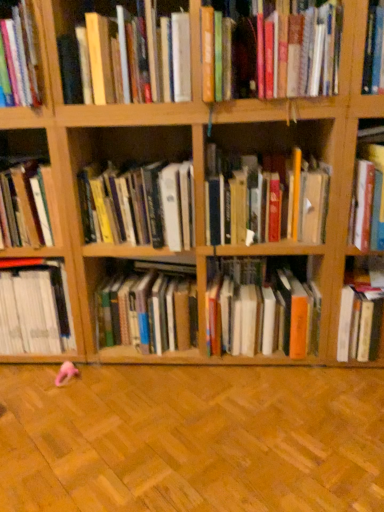
I want to click on hardcover book at upper center, the fifth book in the right-to-left sequence, so pyautogui.click(x=297, y=53).

Find the location of a particular element. hardcover book at center, which is the eighth book in left-to-right order is located at coordinates (265, 200).

The width and height of the screenshot is (384, 512). I want to click on hardcover book at right, placed as the 1th book when sorted from right to left, so click(362, 314).

Locate an element on the screen. This screenshot has width=384, height=512. hardcover book at center, placed as the sixth book when sorted from right to left is located at coordinates (148, 309).

Is point (246, 335) positioned behind point (352, 320)?

Yes, point (246, 335) is farther from viewer.

Considering the relative positions of orange matte book at center, arranged as the third book when viewed from the right, and hardcover book at right, placed as the 1th book when sorted from right to left, in the image provided, is orange matte book at center, arranged as the third book when viewed from the right, to the right of hardcover book at right, placed as the 1th book when sorted from right to left, from the viewer's perspective?

No.

From a real-world perspective, relative to hardcover book at right, which is the eleventh book from left to right, is orange matte book at center, arranged as the 9th book when viewed from the left, vertically above or below?

orange matte book at center, arranged as the 9th book when viewed from the left, is situated higher than hardcover book at right, which is the eleventh book from left to right, in the real world.

Is orange matte book at center, arranged as the third book when viewed from the right, in front of hardcover book at right, placed as the 1th book when sorted from right to left?

Yes, orange matte book at center, arranged as the third book when viewed from the right, is closer to the camera.

Identify the location of book that is the 1st object directly below the hardcover book at center, which is the eighth book in left-to-right order (from a real-world perspective). This screenshot has width=384, height=512. (24, 205).

In the scene shown: Can hardcover book at left, which is counted as the 11th book, starting from the right, be found inside hardcover book at center, which is the eighth book in left-to-right order?

No, hardcover book at center, which is the eighth book in left-to-right order, does not contain hardcover book at left, which is counted as the 11th book, starting from the right.

Which of these two, hardcover book at center, which appears as the 4th book when viewed from the right, or hardcover book at left, which is counted as the 11th book, starting from the right, is smaller?

hardcover book at left, which is counted as the 11th book, starting from the right, is smaller.

Choose the correct answer: Is hardcover book at upper right, the tenth book when ordered from left to right, inside hardcover book at upper left, which ranks as the third book in left-to-right order, or outside it?

hardcover book at upper right, the tenth book when ordered from left to right, is located beyond the bounds of hardcover book at upper left, which ranks as the third book in left-to-right order.

Considering the positions of points (350, 216) and (23, 45), is point (350, 216) farther from camera compared to point (23, 45)?

Yes, point (350, 216) is behind point (23, 45).

Considering the positions of objects hardcover book at upper right, the tenth book when ordered from left to right, and hardcover book at upper left, which ranks as the third book in left-to-right order, in the image provided, who is more to the left, hardcover book at upper right, the tenth book when ordered from left to right, or hardcover book at upper left, which ranks as the third book in left-to-right order,?

Positioned to the left is hardcover book at upper left, which ranks as the third book in left-to-right order.

From the image's perspective, count 2nd books downward from the hardcover book at upper left, acting as the 9th book starting from the right, and point to it. Please provide its 2D coordinates.

[(265, 200)]

From a real-world perspective, is hardcover book at center, which appears as the 4th book when viewed from the right, under hardcover book at upper left, acting as the 9th book starting from the right?

Yes.

Can you confirm if hardcover book at center, which is the eighth book in left-to-right order, is thinner than hardcover book at upper left, acting as the 9th book starting from the right?

Indeed, hardcover book at center, which is the eighth book in left-to-right order, has a lesser width compared to hardcover book at upper left, acting as the 9th book starting from the right.

Which is more to the right, hardcover book at upper center, which is counted as the seventh book, starting from the left, or orange matte book at center, arranged as the 9th book when viewed from the left?

orange matte book at center, arranged as the 9th book when viewed from the left.

You are a GUI agent. You are given a task and a screenshot of the screen. Output one action in this format:
    pyautogui.click(x=<x>, y=<y>)
    Task: Click on the 2nd book to the left of the orange matte book at center, arranged as the 9th book when viewed from the left, counting from the anchor's position
    This screenshot has width=384, height=512.
    Given the screenshot: What is the action you would take?
    pyautogui.click(x=297, y=53)

Is point (311, 17) closer to camera compared to point (244, 281)?

That is True.

Does hardcover book at upper center, which is counted as the seventh book, starting from the left, have a greater width compared to orange matte book at center, arranged as the 9th book when viewed from the left?

No, hardcover book at upper center, which is counted as the seventh book, starting from the left, is not wider than orange matte book at center, arranged as the 9th book when viewed from the left.

Is the position of hardcover book at upper left, which ranks as the third book in left-to-right order, less distant than that of hardcover book at left, the first book viewed from the left?

Yes, it is in front of hardcover book at left, the first book viewed from the left.

In the scene shown: Would you say hardcover book at upper left, acting as the 9th book starting from the right, is a long distance from hardcover book at left, which is counted as the 11th book, starting from the right?

They are positioned close to each other.

Which of these two, hardcover book at upper left, acting as the 9th book starting from the right, or hardcover book at left, the first book viewed from the left, stands shorter?

hardcover book at left, the first book viewed from the left, is shorter.

From the image's perspective, is hardcover book at right, which is the eleventh book from left to right, located beneath hardcover books at upper left, which is the seventh book from right to left?

Yes, from the image's perspective, hardcover book at right, which is the eleventh book from left to right, is beneath hardcover books at upper left, which is the seventh book from right to left.

Is hardcover book at right, placed as the 1th book when sorted from right to left, facing away from hardcover books at upper left, which is counted as the 5th book, starting from the left?

That's not correct — hardcover book at right, placed as the 1th book when sorted from right to left, is not looking away from hardcover books at upper left, which is counted as the 5th book, starting from the left.

From a real-world perspective, is hardcover book at right, placed as the 1th book when sorted from right to left, located beneath hardcover books at upper left, which is counted as the 5th book, starting from the left?

Yes, from a real-world perspective, hardcover book at right, placed as the 1th book when sorted from right to left, is beneath hardcover books at upper left, which is counted as the 5th book, starting from the left.

Which book is the 6th one when counting from the left side of the hardcover book at right, which is the eleventh book from left to right? Please provide its 2D coordinates.

[(126, 53)]

This screenshot has width=384, height=512. In order to click on the 3rd book above the hardcover book at right, placed as the 1th book when sorted from right to left (from the image's perspective) in this screenshot , I will do `click(260, 310)`.

Where is `the 1st book below the hardcover book at center, which is the eighth book in left-to-right order (from a real-world perspective)`? The width and height of the screenshot is (384, 512). the 1st book below the hardcover book at center, which is the eighth book in left-to-right order (from a real-world perspective) is located at coordinates (24, 205).

From the picture: Considering their positions, is hardcover book at upper left, acting as the 9th book starting from the right, positioned closer to hardcover book at center, the 4th book when ordered from left to right, than white matte book at left, the 2th book when ordered from left to right?

white matte book at left, the 2th book when ordered from left to right, is closer to hardcover book at center, the 4th book when ordered from left to right.

Estimate the real-world distances between objects in this image. Which object is closer to hardcover book at left, which is counted as the 11th book, starting from the right, hardcover book at right, which is the eleventh book from left to right, or hardcover books at upper left, which is counted as the 5th book, starting from the left?

hardcover books at upper left, which is counted as the 5th book, starting from the left.

From the image, which object appears to be farther from hardcover book at upper right, which is counted as the 2th book, starting from the right, orange matte book at center, arranged as the third book when viewed from the right, or hardcover book at center, placed as the sixth book when sorted from right to left?

hardcover book at center, placed as the sixth book when sorted from right to left.

When comparing their distances from hardcover book at center, placed as the sixth book when sorted from right to left, does hardcover book at upper center, the fifth book in the right-to-left sequence, or hardcover book at center, the 4th book when ordered from left to right, seem further?

hardcover book at upper center, the fifth book in the right-to-left sequence, is further to hardcover book at center, placed as the sixth book when sorted from right to left.

From the image, which object appears to be nearer to orange matte book at center, arranged as the 9th book when viewed from the left, hardcover book at center, the eighth book viewed from the right, or hardcover book at upper right, the tenth book when ordered from left to right?

Based on the image, hardcover book at center, the eighth book viewed from the right, appears to be nearer to orange matte book at center, arranged as the 9th book when viewed from the left.

Based on their spatial positions, is hardcover book at center, the eighth book viewed from the right, or hardcover book at left, which is counted as the 11th book, starting from the right, closer to white matte book at left, the 2th book when ordered from left to right?

Among the two, hardcover book at left, which is counted as the 11th book, starting from the right, is located nearer to white matte book at left, the 2th book when ordered from left to right.

From the image, which object appears to be nearer to orange matte book at center, arranged as the 9th book when viewed from the left, hardcover book at center, the 6th book positioned from the left, or white matte book at left, the tenth book positioned from the right?

Among the two, hardcover book at center, the 6th book positioned from the left, is located nearer to orange matte book at center, arranged as the 9th book when viewed from the left.

When comparing their distances from hardcover book at center, the eighth book viewed from the right, does hardcover books at upper left, which is counted as the 5th book, starting from the left, or hardcover book at upper left, which ranks as the third book in left-to-right order, seem further?

The object further to hardcover book at center, the eighth book viewed from the right, is hardcover book at upper left, which ranks as the third book in left-to-right order.

Find the location of a particular element. The image size is (384, 512). book between orange matte book at center, arranged as the third book when viewed from the right, and hardcover book at right, which is the eleventh book from left to right, from left to right is located at coordinates (368, 191).

Image resolution: width=384 pixels, height=512 pixels. I want to click on book situated between hardcover book at center, which appears as the 4th book when viewed from the right, and hardcover book at upper right, the tenth book when ordered from left to right, from left to right, so click(x=260, y=310).